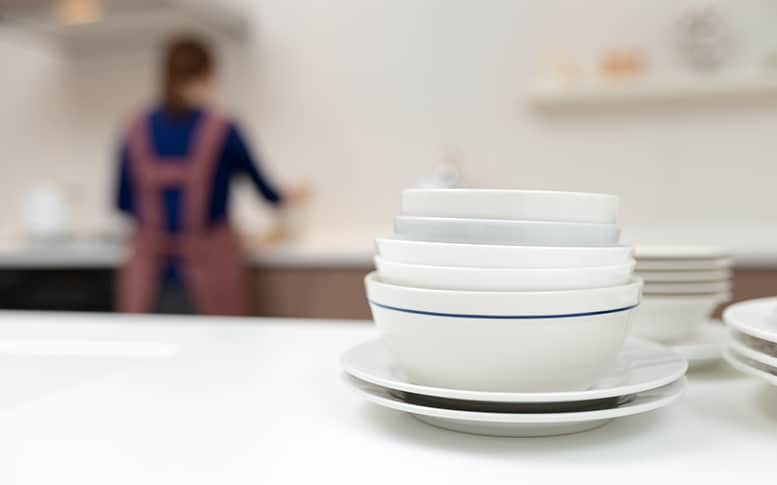
Where is `bowl`? bowl is located at coordinates (549, 340), (525, 279), (537, 258), (548, 238), (559, 209).